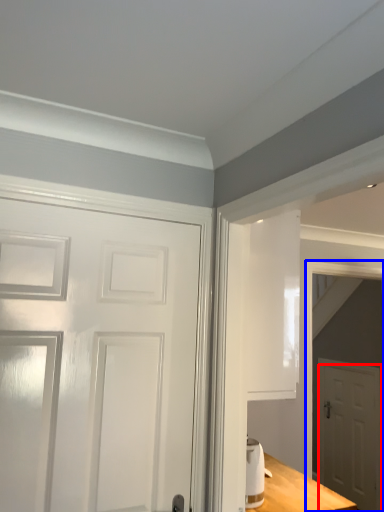
Question: Among these objects, which one is farthest to the camera, door (highlighted by a red box) or elevator (highlighted by a blue box)?

Choices:
 (A) door
 (B) elevator

Answer: (A)